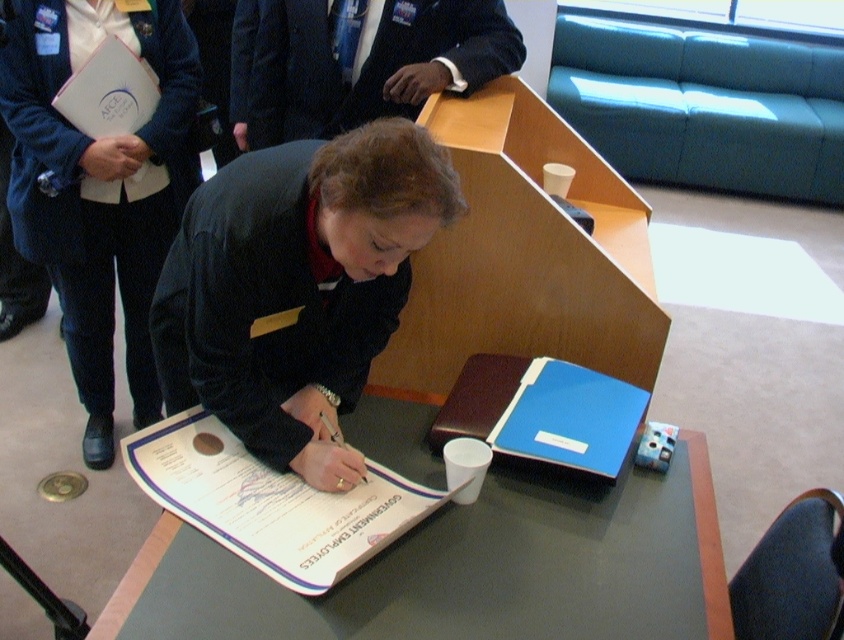
Question: Which object is the closest to the blue plastic clipboard at center?

Choices:
 (A) matte black blazer at upper left
 (B) dark blue suit at center

Answer: (B)

Question: Among these objects, which one is nearest to the camera?

Choices:
 (A) blue plastic clipboard at center
 (B) dark blue suit at upper center
 (C) dark blue suit at center

Answer: (C)

Question: Which point is closer to the camera?

Choices:
 (A) (504, 433)
 (B) (327, 196)
 (C) (39, 163)
 (D) (684, 573)

Answer: (B)

Question: Is smooth gray table at center thinner than dark blue suit at upper center?

Choices:
 (A) no
 (B) yes

Answer: (A)

Question: Observing the image, what is the correct spatial positioning of matte black blazer at upper left in reference to dark blue suit at upper center?

Choices:
 (A) above
 (B) below

Answer: (B)

Question: Is dark blue suit at center below white paper at center?

Choices:
 (A) yes
 (B) no

Answer: (B)